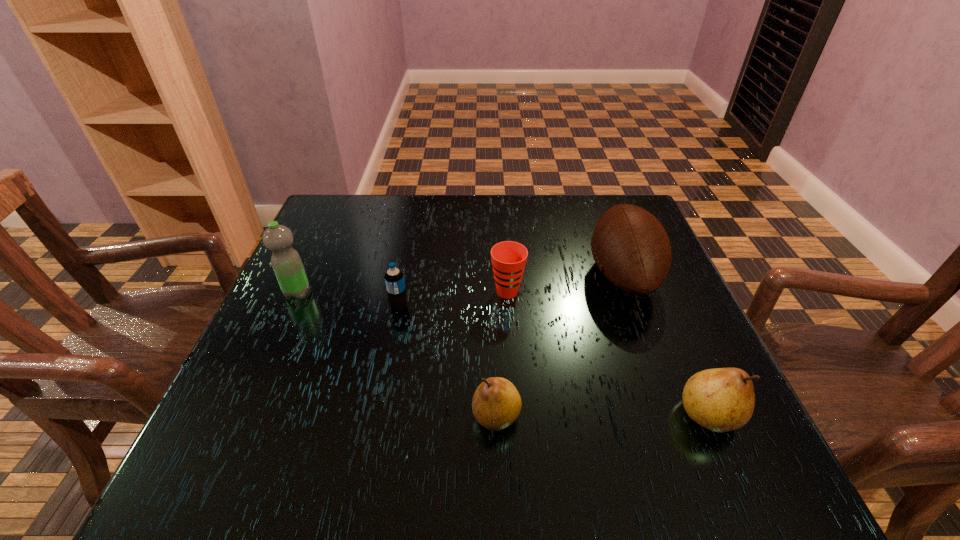
Given the evenly spaced pears in the image, where should an extra pear be added on the left to preserve the spacing? Please point to a vacant space. Please provide its 2D coordinates. Your answer should be formatted as a tuple, i.e. [(x, y)], where the tuple contains the x and y coordinates of a point satisfying the conditions above.

[(283, 417)]